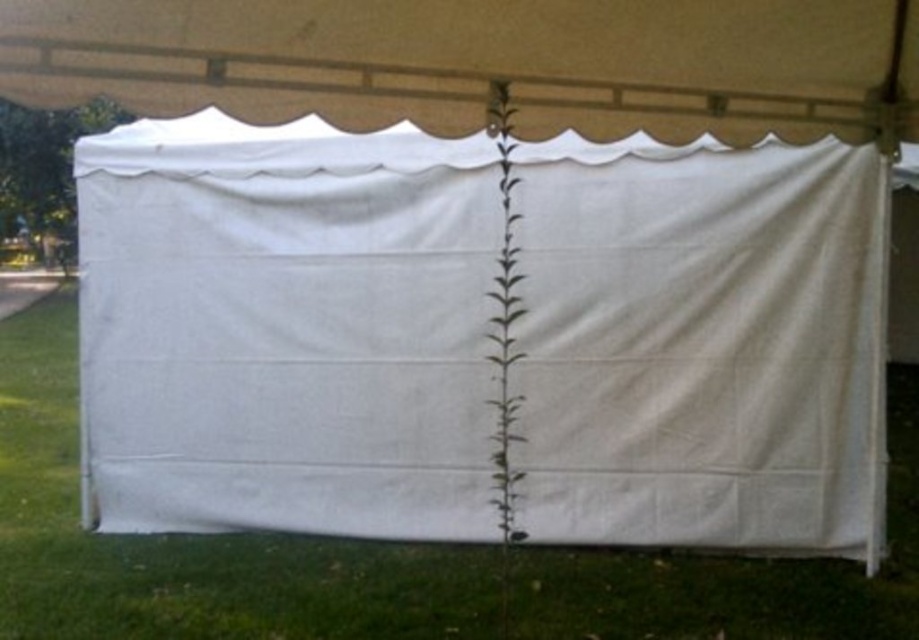
You are planning to set up a picnic under the white fabric canopy at upper center. Considering the height of the canopy and the green grass at lower center, will you be able to stand comfortably inside the canopy without hitting your head?

The white fabric canopy at upper center has a lesser height compared to the green grass at lower center. This implies the canopy is shorter than the grass, so standing inside might be difficult as the height is insufficient for comfortable standing. However, the description might be a mistake since grass is typically shorter than canopies. Please verify the actual measurements.

You are planning to set up a small garden in this area. Considering the green grass at lower center and the green leafy plant at center, which one is taller?

The green leafy plant at center is taller than the green grass at lower center.

You are standing at the point marked as point (x=483, y=61) in the image. What object is located exactly at that point?

The white fabric canopy at upper center is located exactly at point (x=483, y=61).